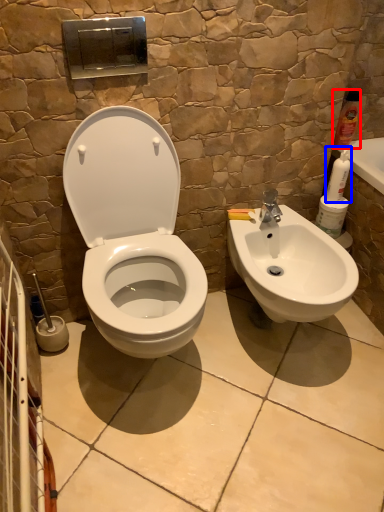
Question: Which of the following is the farthest to the observer, cleaning product (highlighted by a red box) or cleaning product (highlighted by a blue box)?

Choices:
 (A) cleaning product
 (B) cleaning product

Answer: (A)